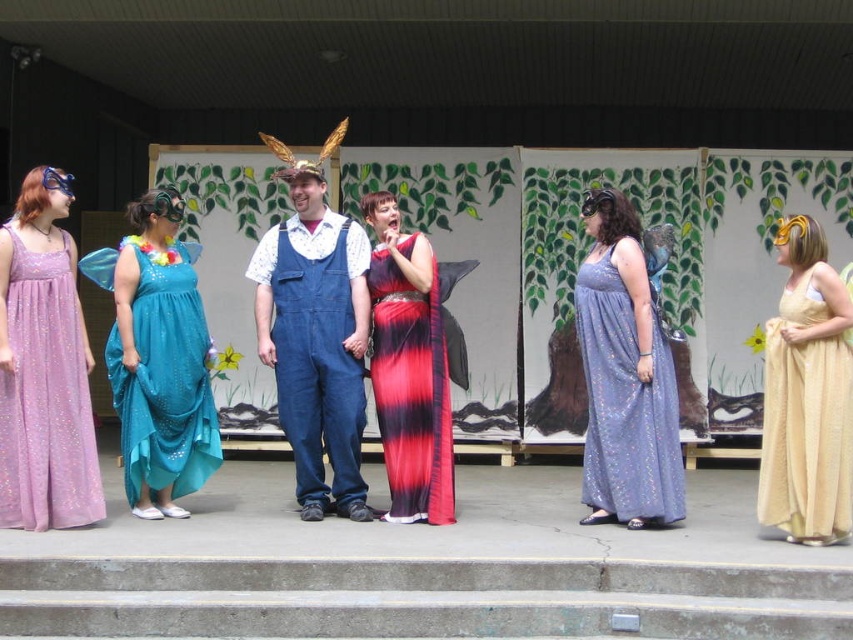
Find the location of a particular element. denim overalls at center is located at coordinates (316, 340).

The height and width of the screenshot is (640, 853). Find the location of `denim overalls at center`. denim overalls at center is located at coordinates (316, 340).

This screenshot has height=640, width=853. Describe the element at coordinates (44, 369) in the screenshot. I see `matte purple gown at left` at that location.

At what (x,y) coordinates should I click in order to perform the action: click on matte purple gown at left. Please return your answer as a coordinate pair (x, y). Image resolution: width=853 pixels, height=640 pixels. Looking at the image, I should click on (44, 369).

Locate an element on the screen. Image resolution: width=853 pixels, height=640 pixels. matte purple gown at left is located at coordinates (44, 369).

Does point (3, 472) come behind point (332, 305)?

No, it is in front of (332, 305).

This screenshot has width=853, height=640. Find the location of `matte purple gown at left`. matte purple gown at left is located at coordinates (44, 369).